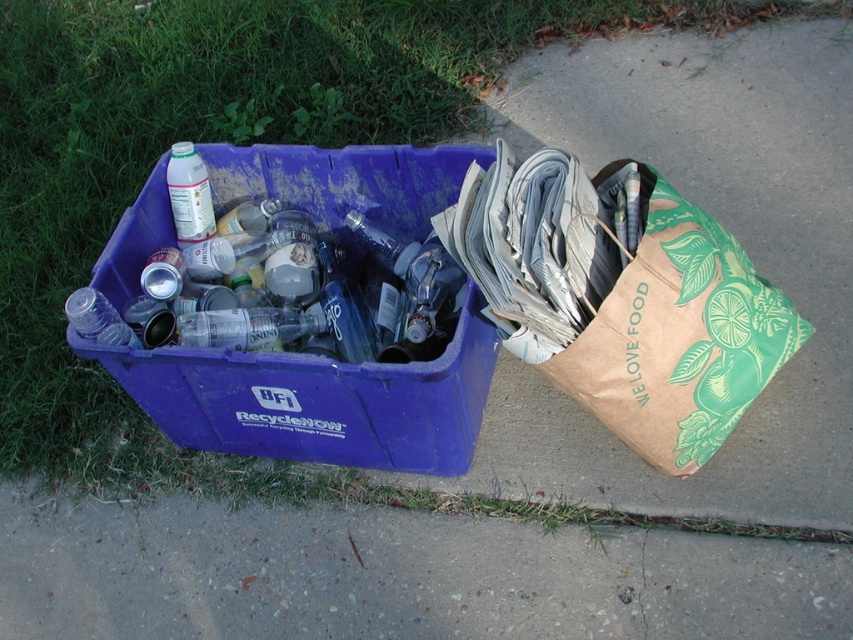
Question: Can you confirm if brown paper bag at right is thinner than translucent plastic bottle at center?

Choices:
 (A) no
 (B) yes

Answer: (A)

Question: Which point is farther to the camera?

Choices:
 (A) (421, 209)
 (B) (71, 321)

Answer: (A)

Question: Does translucent plastic bottle at center have a larger size compared to transparent plastic bottle at left?

Choices:
 (A) no
 (B) yes

Answer: (B)

Question: Which object is the farthest from the transparent plastic bottle at left?

Choices:
 (A) brown paper bag at right
 (B) translucent plastic bottle at upper left
 (C) matte plastic recycling bin at left

Answer: (A)

Question: Which point is farther to the camera?

Choices:
 (A) (354, 417)
 (B) (270, 307)
 (C) (520, 312)
 (D) (90, 323)

Answer: (B)

Question: In this image, where is matte plastic recycling bin at left located relative to transparent plastic bottle at left?

Choices:
 (A) left
 (B) right

Answer: (B)